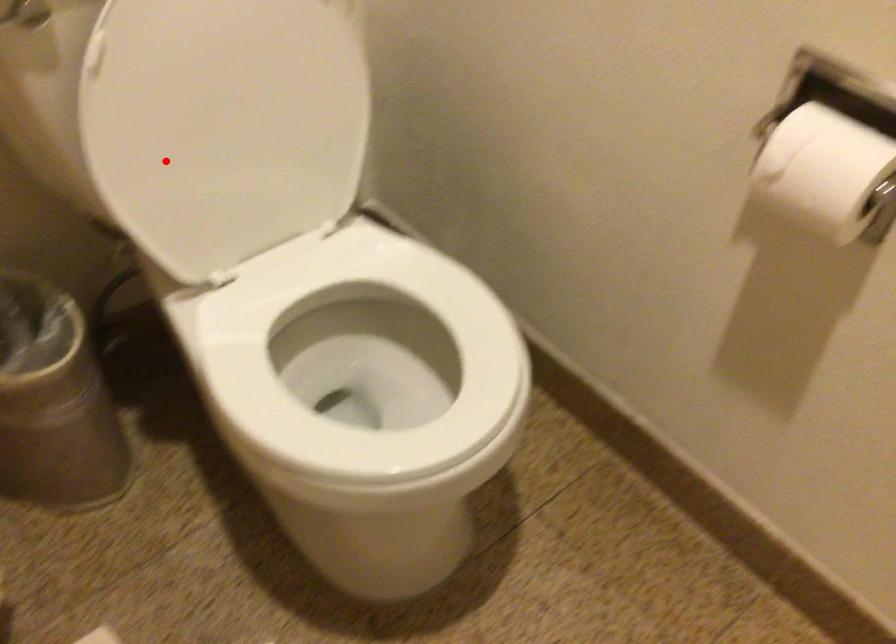
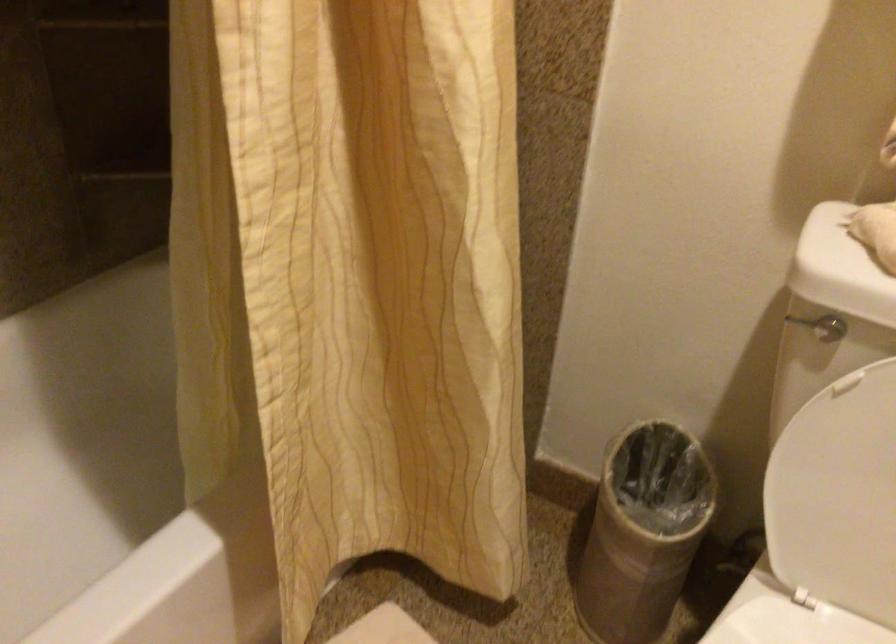
In the second image, find the point that corresponds to the highlighted location in the first image.

(834, 480)